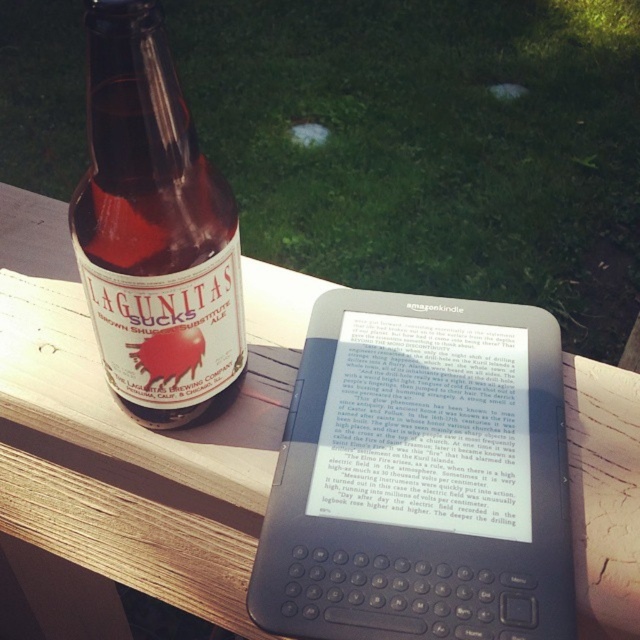
Between wooden bench at upper left and brown glass bottle at left, which one has more height?

wooden bench at upper left

Does wooden bench at upper left come behind brown glass bottle at left?

Yes, wooden bench at upper left is behind brown glass bottle at left.

Who is more forward, (260, 284) or (216, 360)?

Point (216, 360) is more forward.

This screenshot has height=640, width=640. I want to click on wooden bench at upper left, so click(x=125, y=445).

Between point (314, 397) and point (182, 374), which one is positioned in front?

Positioned in front is point (182, 374).

The width and height of the screenshot is (640, 640). In order to click on black plastic kindle at center in this screenshot , I will do `click(420, 477)`.

Find the location of a particular element. The height and width of the screenshot is (640, 640). black plastic kindle at center is located at coordinates (420, 477).

In order to click on black plastic kindle at center in this screenshot , I will do `click(420, 477)`.

Who is taller, black plastic kindle at center or wooden bench at upper left?

Standing taller between the two is wooden bench at upper left.

Is point (522, 612) behind point (4, 442)?

No.

Where is `black plastic kindle at center`? The height and width of the screenshot is (640, 640). black plastic kindle at center is located at coordinates (420, 477).